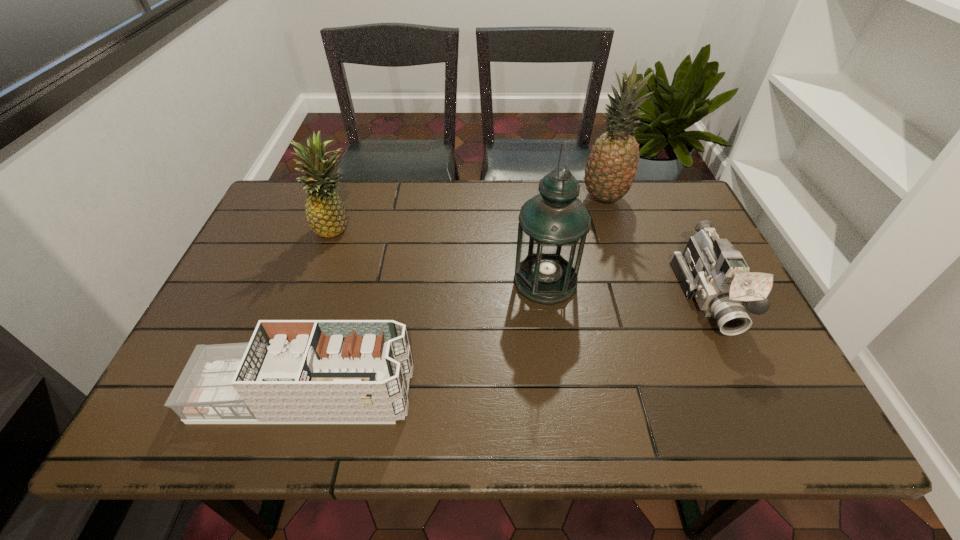
Find the location of a particular element. This screenshot has width=960, height=540. vacant point located on the right of the second farthest object is located at coordinates (414, 228).

Locate an element on the screen. blank space located on the front-facing side of the camcorder is located at coordinates (752, 388).

Where is `free space located 0.400m at the entrance of the shortest object`? free space located 0.400m at the entrance of the shortest object is located at coordinates (605, 394).

Locate an element on the screen. object that is at the near edge is located at coordinates (303, 371).

Locate an element on the screen. The height and width of the screenshot is (540, 960). pineapple that is positioned at the left edge is located at coordinates (326, 215).

Image resolution: width=960 pixels, height=540 pixels. In order to click on dollhouse that is at the left edge in this screenshot , I will do `click(303, 371)`.

You are a GUI agent. You are given a task and a screenshot of the screen. Output one action in this format:
    pyautogui.click(x=<x>, y=<y>)
    Task: Click on the object situated at the right edge
    This screenshot has height=540, width=960.
    Given the screenshot: What is the action you would take?
    pyautogui.click(x=711, y=270)

Locate an element on the screen. object located in the far left corner section of the desktop is located at coordinates (326, 215).

You are a GUI agent. You are given a task and a screenshot of the screen. Output one action in this format:
    pyautogui.click(x=<x>, y=<y>)
    Task: Click on the object that is at the near left corner
    The height and width of the screenshot is (540, 960).
    Given the screenshot: What is the action you would take?
    pyautogui.click(x=303, y=371)

Where is `vacant space at the far edge of the desktop`? The height and width of the screenshot is (540, 960). vacant space at the far edge of the desktop is located at coordinates (508, 204).